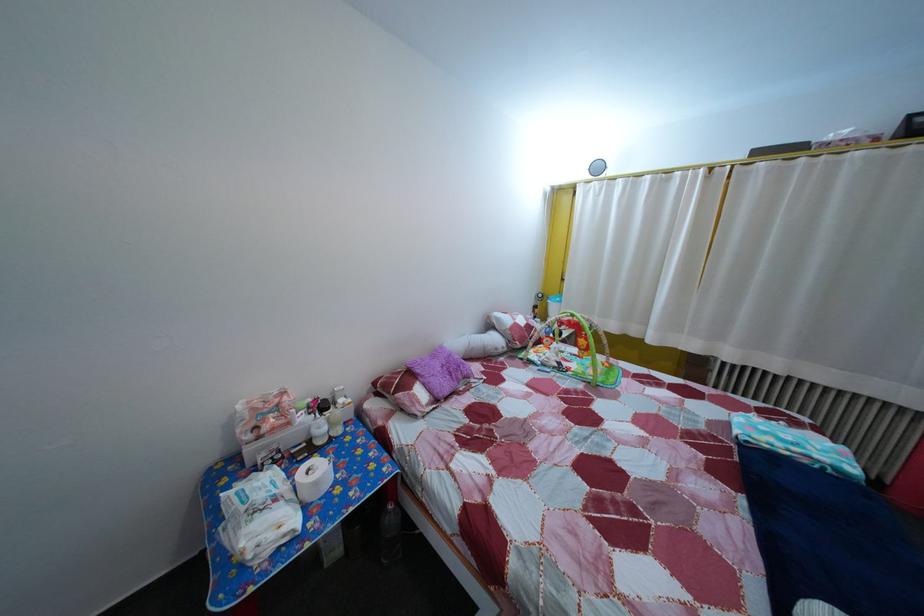
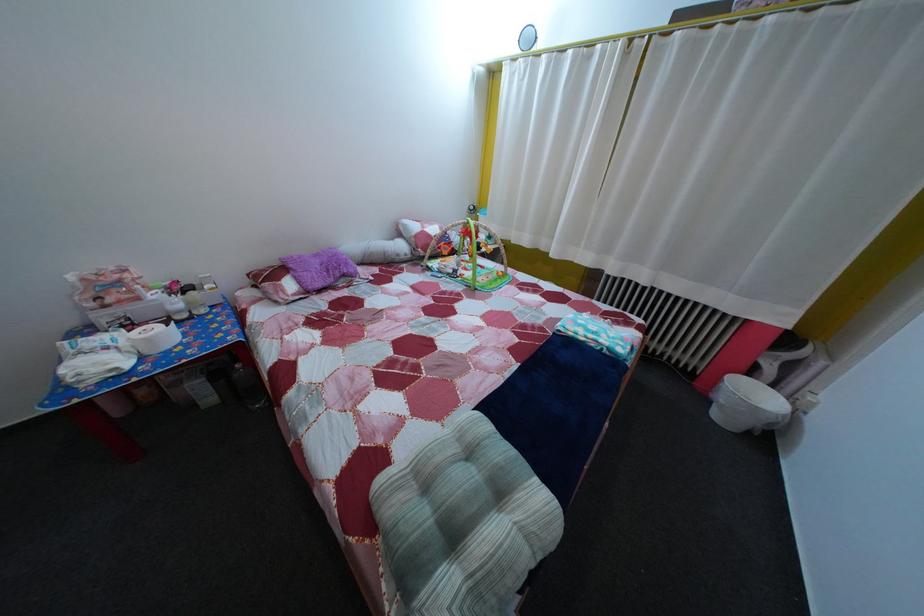
Locate, in the second image, the point that corresponds to pixel 350 408 in the first image.

(216, 294)